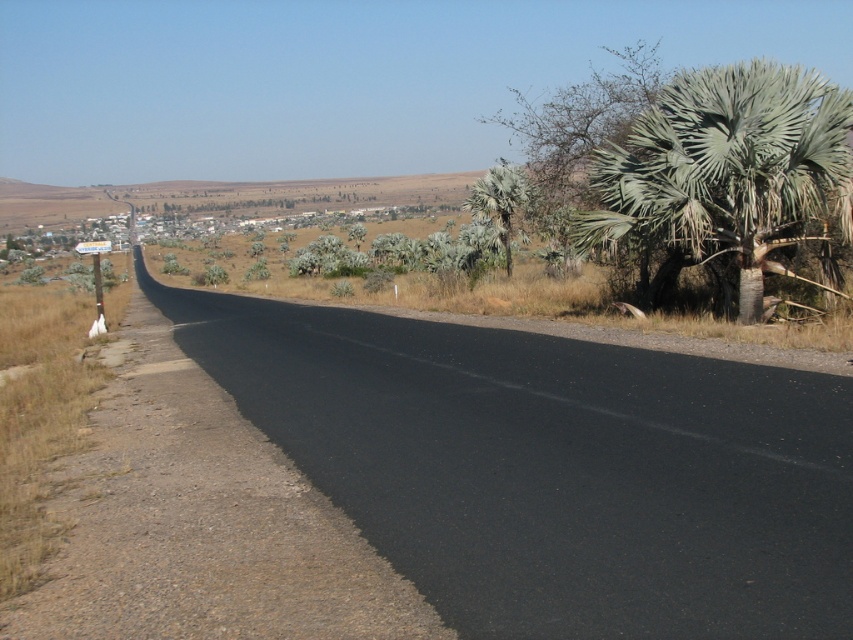
Question: Is green leafy palm tree at right to the left of green leafy palm at right from the viewer's perspective?

Choices:
 (A) no
 (B) yes

Answer: (A)

Question: Is green leafy palm tree at right positioned before green leafy palm at right?

Choices:
 (A) yes
 (B) no

Answer: (A)

Question: Can you confirm if green leafy palm tree at right is positioned below green leafy palm at right?

Choices:
 (A) no
 (B) yes

Answer: (B)

Question: Which of the following is the closest to the observer?

Choices:
 (A) (663, 104)
 (B) (469, 195)

Answer: (A)

Question: Which object is farther from the camera taking this photo?

Choices:
 (A) green leafy palm at right
 (B) green leafy palm tree at right

Answer: (A)